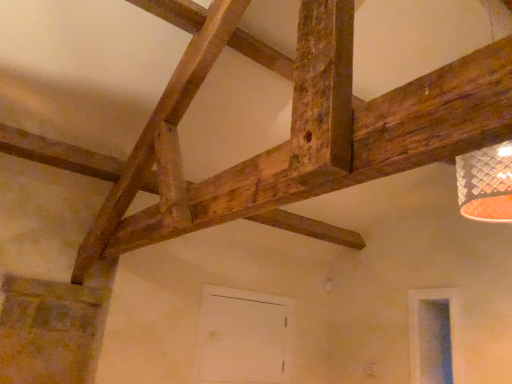
What are the coordinates of `transparent glass window at lower right` in the screenshot? It's located at (435, 336).

What do you see at coordinates (435, 336) in the screenshot? The image size is (512, 384). I see `transparent glass window at lower right` at bounding box center [435, 336].

The width and height of the screenshot is (512, 384). Describe the element at coordinates (241, 337) in the screenshot. I see `white matte door at center` at that location.

The image size is (512, 384). What are the coordinates of `white matte door at center` in the screenshot? It's located at (241, 337).

Locate an element on the screen. The width and height of the screenshot is (512, 384). transparent glass window at lower right is located at coordinates (435, 336).

Which is more to the right, transparent glass window at lower right or white matte door at center?

transparent glass window at lower right is more to the right.

Between transparent glass window at lower right and white matte door at center, which one is positioned in front?

transparent glass window at lower right is more forward.

Between point (445, 290) and point (218, 328), which one is positioned in front?

The point (445, 290) is closer.

From the image's perspective, which one is positioned higher, transparent glass window at lower right or white matte door at center?

→ From the image's view, transparent glass window at lower right is above.

From a real-world perspective, is transparent glass window at lower right physically below white matte door at center?

No.

Considering the relative sizes of transparent glass window at lower right and white matte door at center in the image provided, is transparent glass window at lower right thinner than white matte door at center?

Correct, the width of transparent glass window at lower right is less than that of white matte door at center.

Does transparent glass window at lower right have a greater height compared to white matte door at center?

Incorrect, the height of transparent glass window at lower right is not larger of that of white matte door at center.

In terms of size, does transparent glass window at lower right appear bigger or smaller than white matte door at center?

Clearly, transparent glass window at lower right is smaller in size than white matte door at center.

Would you say transparent glass window at lower right is inside or outside white matte door at center?

transparent glass window at lower right is outside white matte door at center.

Is transparent glass window at lower right next to white matte door at center?

transparent glass window at lower right and white matte door at center are clearly separated.

Could you tell me if transparent glass window at lower right is turned towards white matte door at center?

No, transparent glass window at lower right is not facing towards white matte door at center.

How different are the orientations of transparent glass window at lower right and white matte door at center in degrees?

88.6 degrees.

The width and height of the screenshot is (512, 384). Find the location of `door below the transparent glass window at lower right (from a real-world perspective)`. door below the transparent glass window at lower right (from a real-world perspective) is located at coordinates (241, 337).

Considering the relative positions of white matte door at center and transparent glass window at lower right in the image provided, is white matte door at center to the right of transparent glass window at lower right from the viewer's perspective?

Incorrect, white matte door at center is not on the right side of transparent glass window at lower right.

In the scene shown: Considering the positions of objects white matte door at center and transparent glass window at lower right in the image provided, who is behind, white matte door at center or transparent glass window at lower right?

Positioned behind is white matte door at center.

Is point (234, 303) in front of point (438, 296)?

No, it is not.

Consider the image. From the image's perspective, which is above, white matte door at center or transparent glass window at lower right?

transparent glass window at lower right appears higher in the image.

From a real-world perspective, which is physically above, white matte door at center or transparent glass window at lower right?

In real-world perspective, transparent glass window at lower right is above.

Based on the photo, considering the relative sizes of white matte door at center and transparent glass window at lower right in the image provided, is white matte door at center thinner than transparent glass window at lower right?

In fact, white matte door at center might be wider than transparent glass window at lower right.

Considering the sizes of objects white matte door at center and transparent glass window at lower right in the image provided, who is shorter, white matte door at center or transparent glass window at lower right?

transparent glass window at lower right is shorter.

Which of these two, white matte door at center or transparent glass window at lower right, is smaller?

With smaller size is transparent glass window at lower right.

Is white matte door at center not within transparent glass window at lower right?

white matte door at center is positioned outside transparent glass window at lower right.

Would you consider white matte door at center to be distant from transparent glass window at lower right?

That's right, there is a large distance between white matte door at center and transparent glass window at lower right.

In the scene shown: Is white matte door at center facing away from transparent glass window at lower right?

That's not correct — white matte door at center is not looking away from transparent glass window at lower right.

How different are the orientations of white matte door at center and transparent glass window at lower right in degrees?

88.6 degrees.

Identify the location of door below the transparent glass window at lower right (from the image's perspective). This screenshot has width=512, height=384. (241, 337).

Locate an element on the screen. window located above the white matte door at center (from the image's perspective) is located at coordinates (435, 336).

The image size is (512, 384). Find the location of `door that is behind the transparent glass window at lower right`. door that is behind the transparent glass window at lower right is located at coordinates (241, 337).